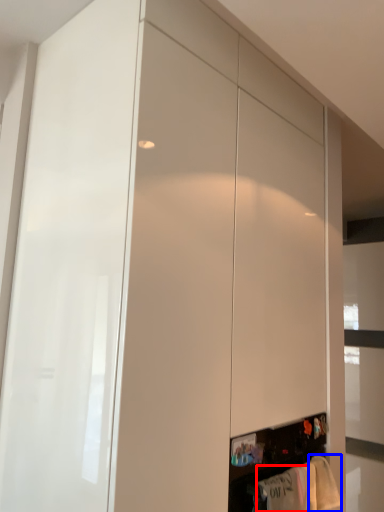
Question: Which object appears farthest to the camera in this image, clothing (highlighted by a red box) or clothing (highlighted by a blue box)?

Choices:
 (A) clothing
 (B) clothing

Answer: (B)